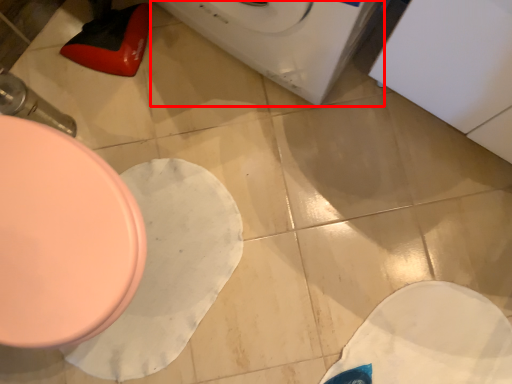
Question: From the image's perspective, considering the relative positions of washing machine (annotated by the red box) and toilet in the image provided, where is washing machine (annotated by the red box) located with respect to the staircase?

Choices:
 (A) above
 (B) below

Answer: (A)